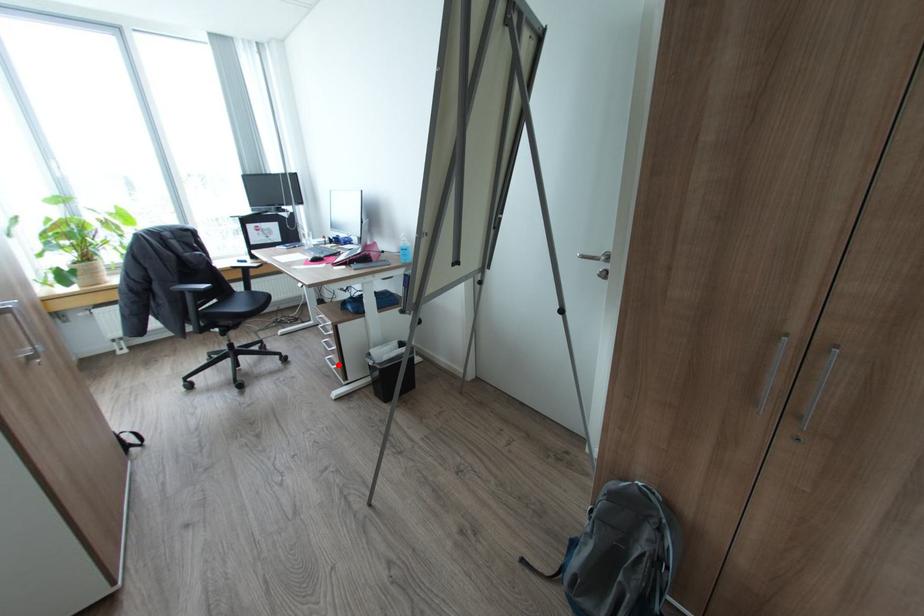
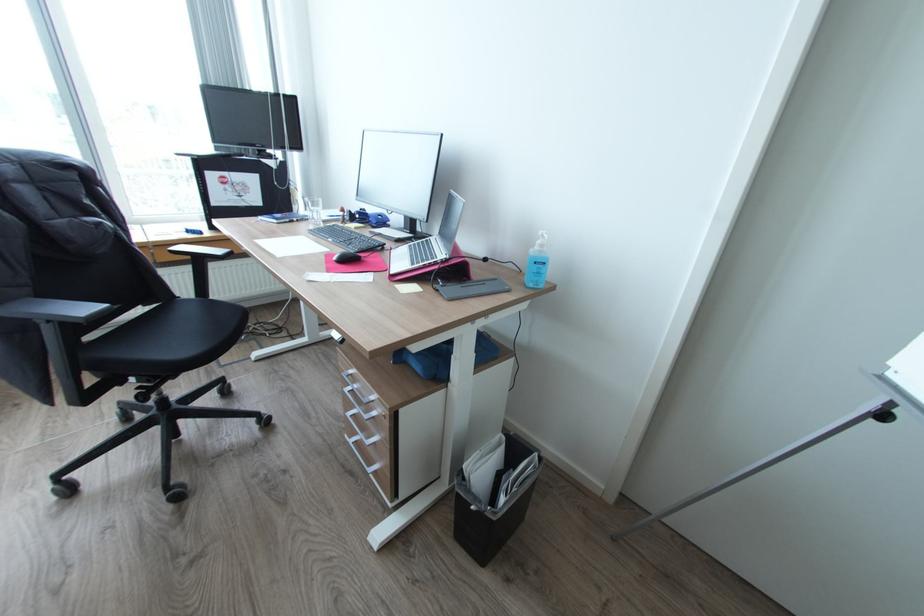
Locate, in the second image, the point that corresponds to the highlighted location in the first image.

(373, 464)